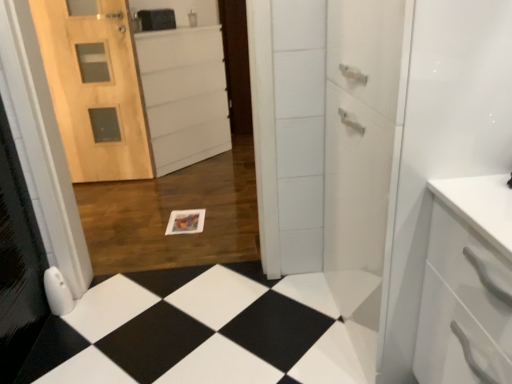
Question: Is point (165, 87) closer or farther from the camera than point (309, 307)?

Choices:
 (A) farther
 (B) closer

Answer: (A)

Question: In terms of size, does white matte cabinet at center appear bigger or smaller than black glossy tile at lower center?

Choices:
 (A) big
 (B) small

Answer: (A)

Question: Estimate the real-world distances between objects in this image. Which object is closer to the white matte cabinet at center?

Choices:
 (A) natural wood door at left
 (B) black glossy tile at lower center

Answer: (A)

Question: Which is nearer to the natural wood door at left?

Choices:
 (A) black glossy tile at lower center
 (B) white matte cabinet at center

Answer: (B)